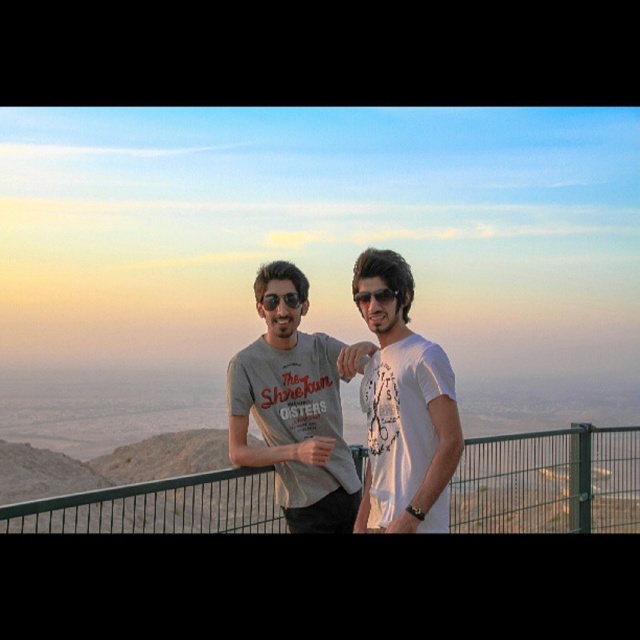
Is matte gray t-shirt at center bigger than white matte t-shirt at center?

Indeed, matte gray t-shirt at center has a larger size compared to white matte t-shirt at center.

What do you see at coordinates (358, 403) in the screenshot?
I see `matte gray t-shirt at center` at bounding box center [358, 403].

Measure the distance between point (449, 380) and camera.

Point (449, 380) and camera are 148.54 feet apart.

Identify the location of matte gray t-shirt at center. (358, 403).

Does point (636, 458) come behind point (278, 298)?

Yes.

Is green metal fence at center further to the viewer compared to matte black sunglasses at center?

No, it is not.

This screenshot has height=640, width=640. What do you see at coordinates (548, 481) in the screenshot? I see `green metal fence at center` at bounding box center [548, 481].

At what (x,y) coordinates should I click in order to perform the action: click on green metal fence at center. Please return your answer as a coordinate pair (x, y). Looking at the image, I should click on (548, 481).

Is green metal fence at center taller than white matte t-shirt at center?

In fact, green metal fence at center may be shorter than white matte t-shirt at center.

I want to click on green metal fence at center, so click(x=548, y=481).